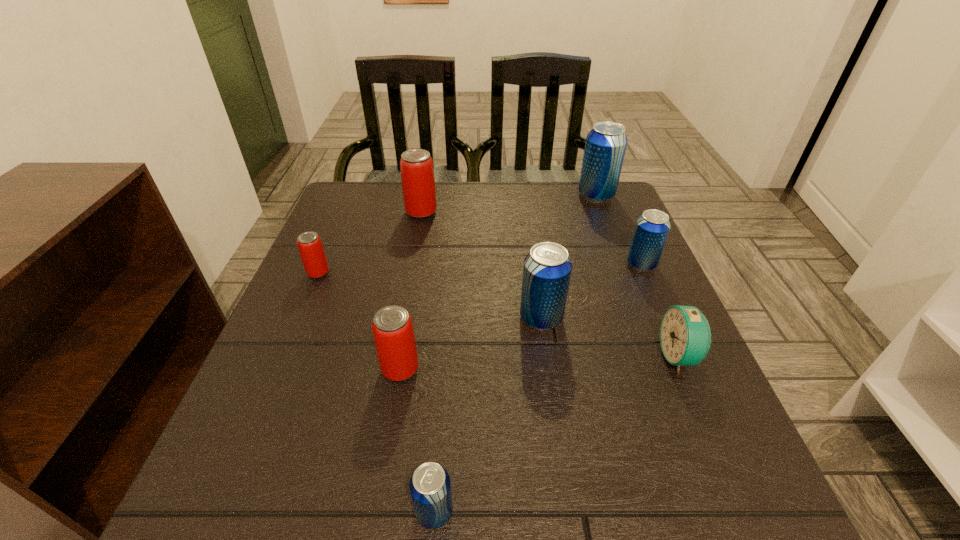
This screenshot has height=540, width=960. I want to click on vacant space situated on the front-facing side of the alarm clock, so click(x=520, y=356).

Locate an element on the screen. The width and height of the screenshot is (960, 540). vacant region located 0.220m on the front of the leftmost beer can is located at coordinates (281, 360).

The height and width of the screenshot is (540, 960). Identify the location of vacant point located 0.090m on the back of the fourth beer can from right to left. (440, 434).

Find the location of a particular element. The width and height of the screenshot is (960, 540). object that is positioned at the near edge is located at coordinates (430, 487).

Locate an element on the screen. object situated at the left edge is located at coordinates (311, 250).

This screenshot has width=960, height=540. Identify the location of alarm clock situated at the right edge. (685, 337).

Find the location of a particular element. object located in the far right corner section of the desktop is located at coordinates coord(606,143).

At what (x,y) coordinates should I click in order to perform the action: click on vacant space at the far edge of the desktop. Please return your answer as a coordinate pair (x, y). Looking at the image, I should click on (531, 224).

In order to click on vacant space at the near edge of the desktop in this screenshot , I will do `click(529, 532)`.

At what (x,y) coordinates should I click in order to perform the action: click on vacant area at the left edge. Please return your answer as a coordinate pair (x, y). Looking at the image, I should click on (315, 334).